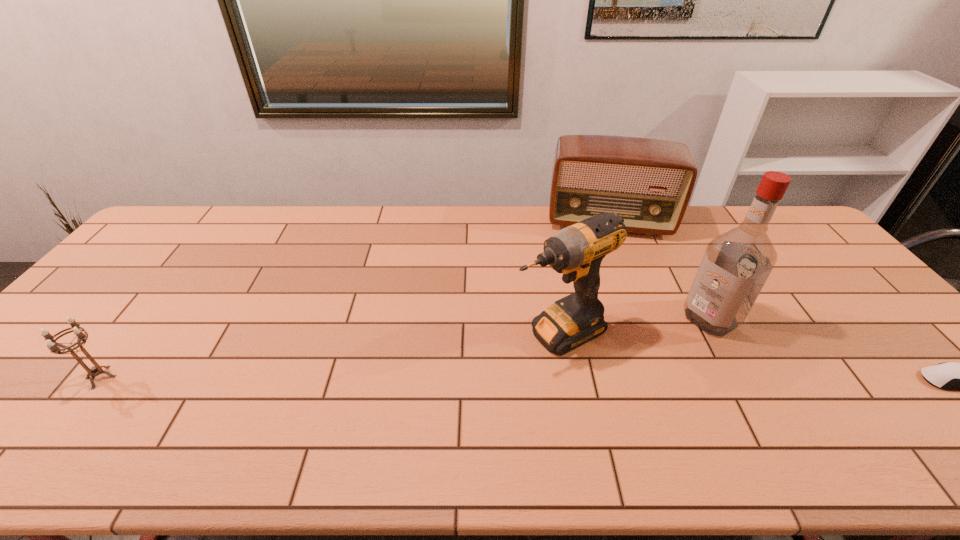
At what (x,y) coordinates should I click in order to perform the action: click on blank space at the far edge. Please return your answer as a coordinate pair (x, y). The width and height of the screenshot is (960, 540). Looking at the image, I should click on (293, 236).

Where is `free region at the near edge of the desktop`? This screenshot has height=540, width=960. free region at the near edge of the desktop is located at coordinates (895, 417).

At what (x,y) coordinates should I click in order to perform the action: click on free space at the left edge of the desktop. Please return your answer as a coordinate pair (x, y). Image resolution: width=960 pixels, height=540 pixels. Looking at the image, I should click on (160, 277).

Identify the location of vacant area at the right edge. Image resolution: width=960 pixels, height=540 pixels. (884, 362).

Identify the location of free space at the far left corner of the desktop. The image size is (960, 540). (172, 239).

What are the coordinates of `vacant region at the near right corner of the desktop` in the screenshot? It's located at (948, 397).

Where is `free spot between the drill and the tallest object`? This screenshot has width=960, height=540. free spot between the drill and the tallest object is located at coordinates (635, 325).

Where is `vacant area that lies between the tallest object and the candle holder`? This screenshot has height=540, width=960. vacant area that lies between the tallest object and the candle holder is located at coordinates (406, 348).

You are a GUI agent. You are given a task and a screenshot of the screen. Output one action in this format:
    pyautogui.click(x=<x>, y=<y>)
    Task: Click on the empty location between the fourth shortest object and the tallest object
    This screenshot has width=960, height=540.
    Given the screenshot: What is the action you would take?
    pyautogui.click(x=635, y=325)

The image size is (960, 540). Find the location of `empty space between the radio receiver and the candle holder`. empty space between the radio receiver and the candle holder is located at coordinates (355, 300).